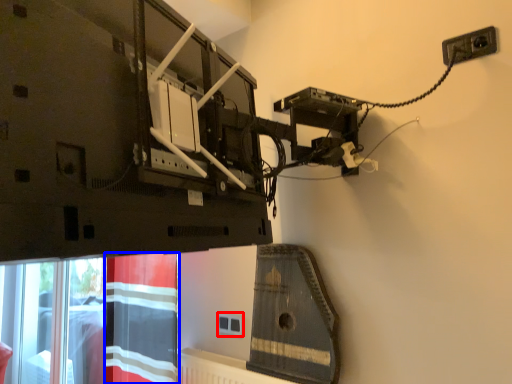
Question: Which object appears closest to the camera in this image, socket (highlighted by a red box) or curtain (highlighted by a blue box)?

Choices:
 (A) socket
 (B) curtain

Answer: (B)